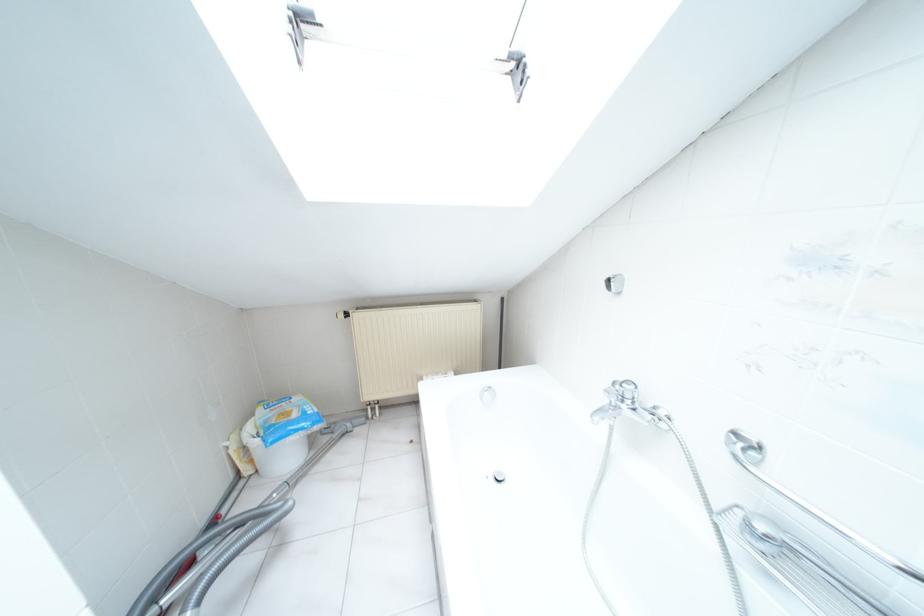
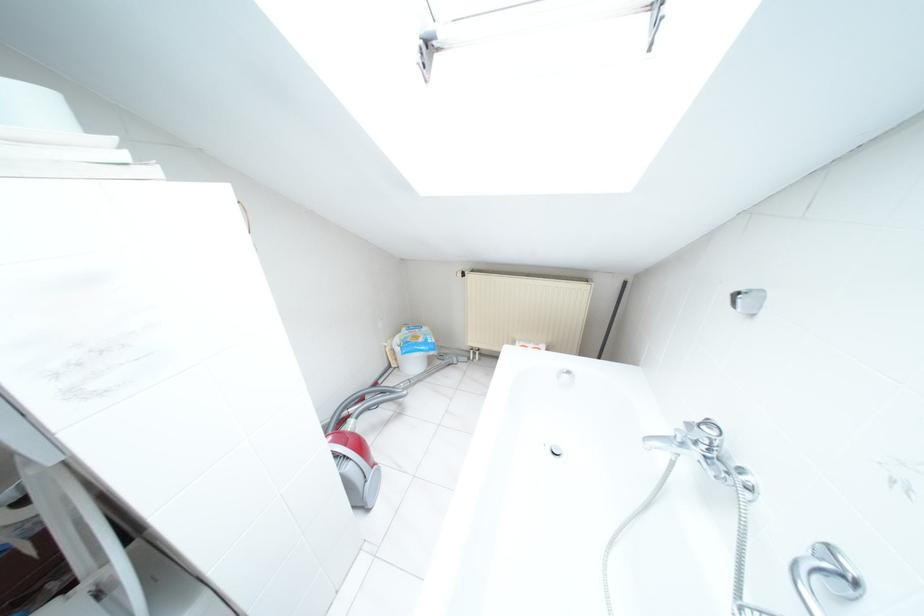
Locate, in the second image, the point that corresponds to (x=488, y=387) in the first image.

(567, 371)